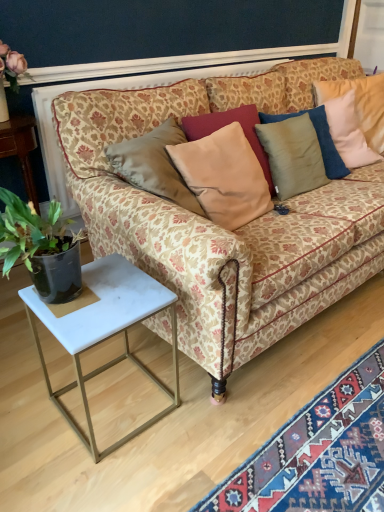
Identify the location of vacant region above white marble side table at lower left (from a real-world perspective). (104, 303).